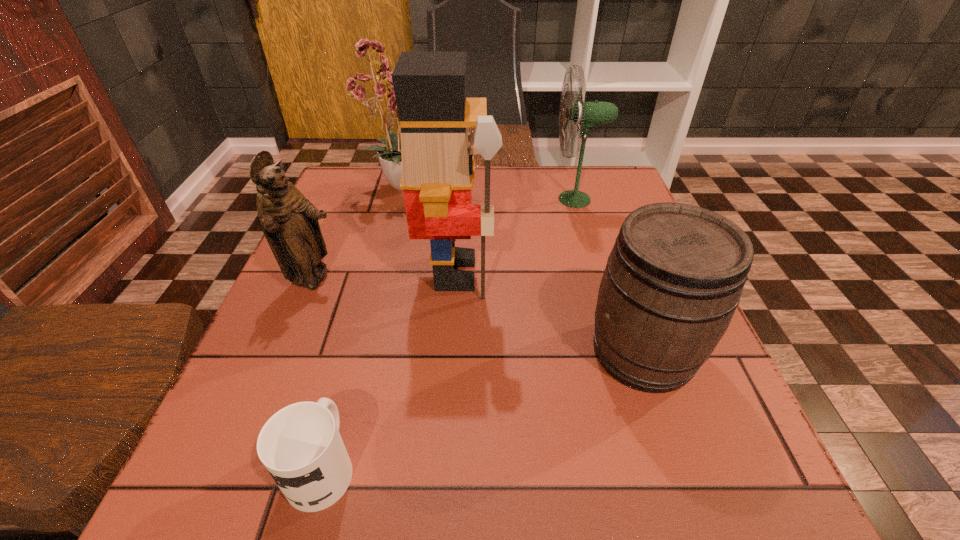
You are a GUI agent. You are given a task and a screenshot of the screen. Output one action in this format:
    pyautogui.click(x=<x>, y=<y>)
    Task: Click on the vacant point at the left edge
    This screenshot has height=540, width=960.
    Given the screenshot: What is the action you would take?
    pyautogui.click(x=357, y=260)

Identify the location of vacant space at the right edge. (717, 370).

The image size is (960, 540). In the image, there is a desktop. Find the location of `vacant space at the far left corner`. vacant space at the far left corner is located at coordinates (328, 191).

Identify the location of free region at the near left corner. [253, 491].

Identify the location of vacant area at the far right corner of the desktop. The height and width of the screenshot is (540, 960). (565, 172).

I want to click on free space at the near right corner of the desktop, so click(x=756, y=463).

I want to click on free spot between the mug and the fan, so click(x=448, y=333).

Where is `free space between the mug and the flower arrangement`? This screenshot has width=960, height=540. free space between the mug and the flower arrangement is located at coordinates (365, 325).

This screenshot has width=960, height=540. I want to click on unoccupied position between the nutcracker and the figurine, so click(385, 276).

Where is `free space between the nutcracker and the fan`? This screenshot has width=960, height=540. free space between the nutcracker and the fan is located at coordinates (516, 236).